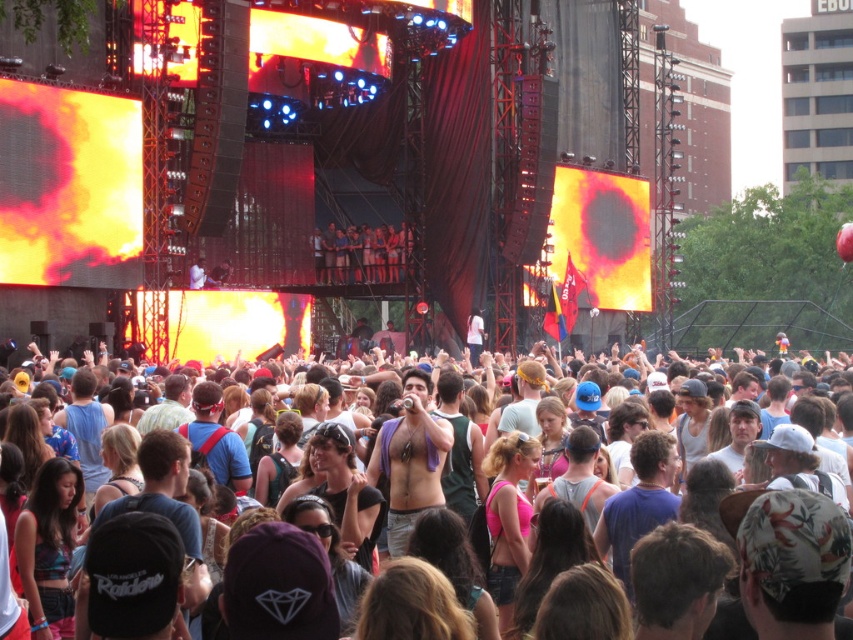
Question: Which object is closer to the camera taking this photo?

Choices:
 (A) multicolored casual attire at center
 (B) matte black camera at upper center

Answer: (A)

Question: Does multicolored casual attire at center appear under matte black camera at upper center?

Choices:
 (A) no
 (B) yes

Answer: (B)

Question: Can you confirm if multicolored casual attire at center is wider than matte black camera at upper center?

Choices:
 (A) no
 (B) yes

Answer: (B)

Question: Which object appears closest to the camera in this image?

Choices:
 (A) matte black camera at upper center
 (B) multicolored casual attire at center

Answer: (B)

Question: Can you confirm if multicolored casual attire at center is positioned to the right of matte black camera at upper center?

Choices:
 (A) yes
 (B) no

Answer: (A)

Question: Which point is farther to the camera?

Choices:
 (A) multicolored casual attire at center
 (B) matte black camera at upper center

Answer: (B)